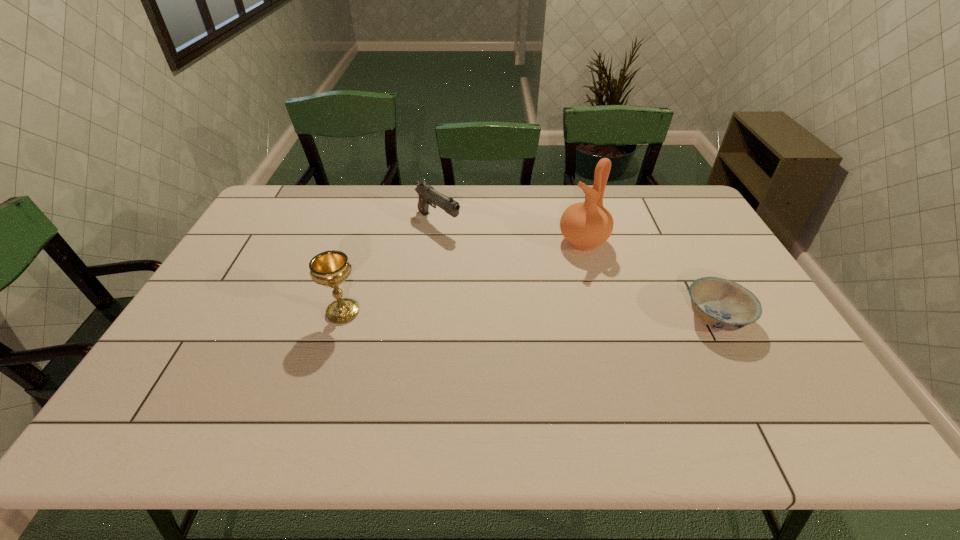
Where is `the leftmost object`? the leftmost object is located at coordinates (331, 268).

Where is `chalice`? This screenshot has height=540, width=960. chalice is located at coordinates (331, 268).

The height and width of the screenshot is (540, 960). I want to click on the shortest object, so click(x=722, y=304).

This screenshot has height=540, width=960. Identify the location of bowl. [722, 304].

Locate an element on the screen. This screenshot has height=540, width=960. the tallest object is located at coordinates (585, 225).

This screenshot has width=960, height=540. Find the location of `pottery`. pottery is located at coordinates (585, 225).

Identify the location of the second shortest object. (427, 195).

Locate an element on the screen. Image resolution: width=960 pixels, height=540 pixels. gun is located at coordinates (427, 195).

In order to click on free region located 0.070m on the left of the second tallest object in this screenshot , I will do `click(299, 312)`.

Find the location of a particular element. The width and height of the screenshot is (960, 540). vacant position located 0.230m on the left of the bowl is located at coordinates (597, 317).